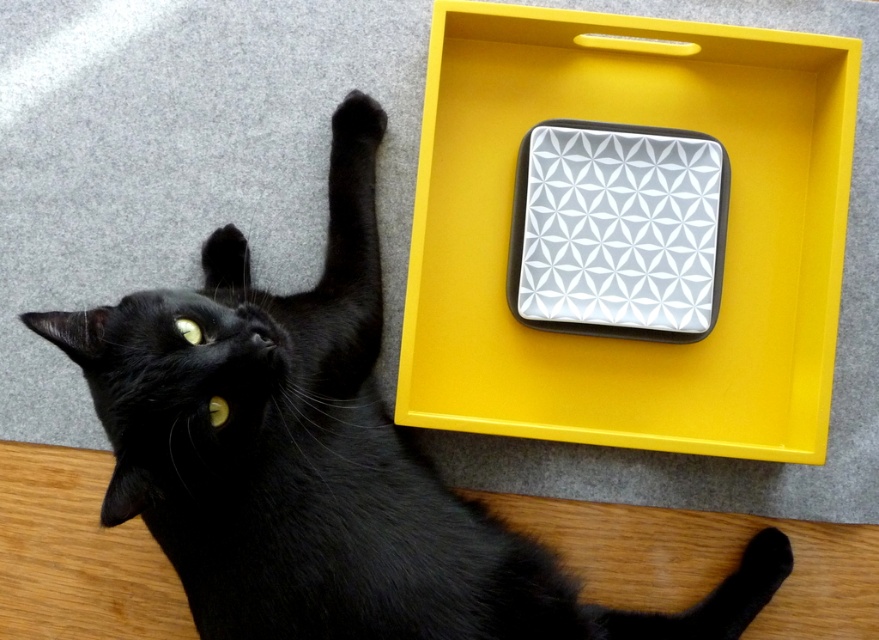
You are a robotic vacuum cleaner positioned at the origin point of the room. You need to locate the yellow matte tray at upper right. What are the coordinates you should move towards?

The yellow matte tray at upper right is located at coordinates 0.367 in the x direction and 0.827 in the y direction.

You are a toy mouse that is 5 cm in length. You want to hide under the yellow matte tray at upper right to avoid being seen by the cat. However, the white glossy square at center is already occupying space under the tray. Can you still fit under the tray?

The yellow matte tray at upper right is larger in size than the white glossy square at center, so there might be enough space left under the tray for the toy mouse to hide. However, the exact remaining space depends on the position of the white glossy square at center.

You are a photographer positioned at the point marked by the coordinates point [618,230]. Looking at the image, which object is directly in front of you?

The white glossy square at center is directly in front of the photographer at point [618,230].